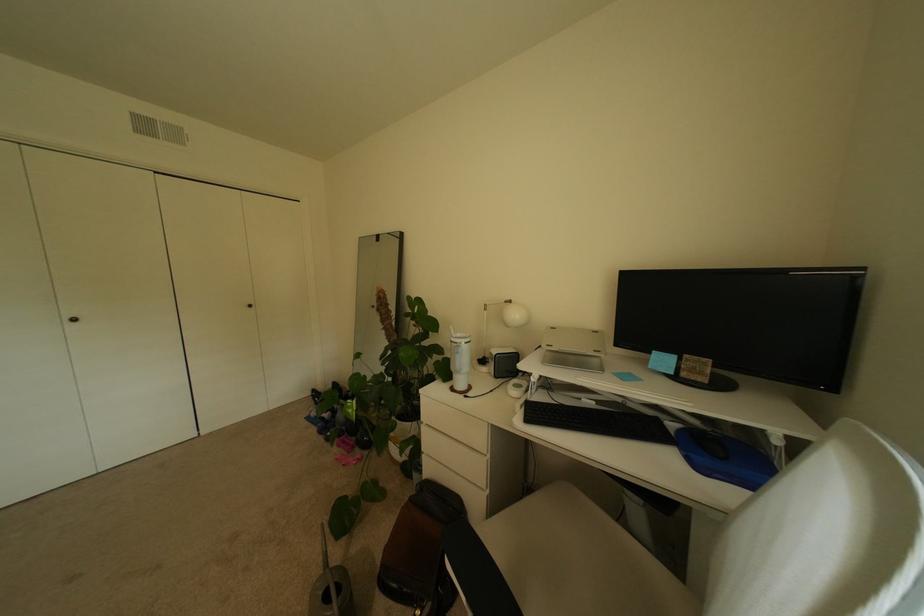
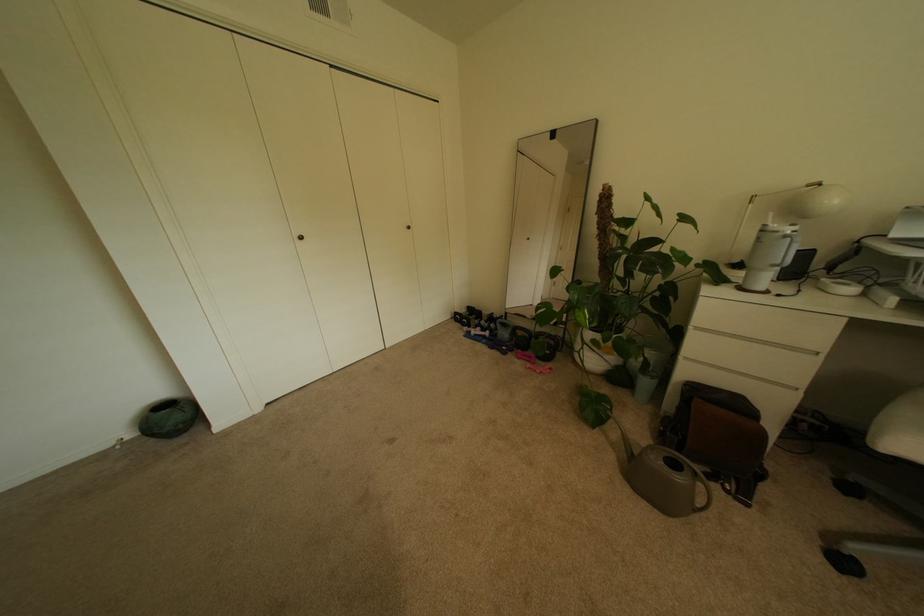
The point at (471, 344) is marked in the first image. Where is the corresponding point in the second image?

(796, 233)